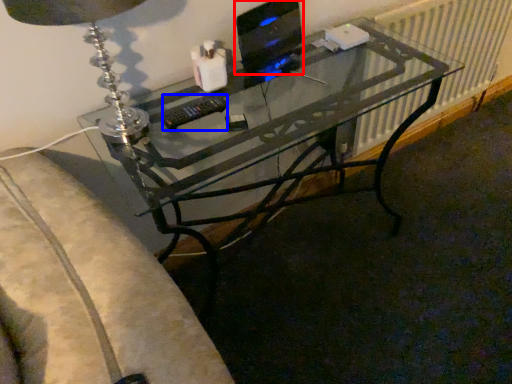
Question: Which object is further to the camera taking this photo, computer monitor (highlighted by a red box) or control (highlighted by a blue box)?

Choices:
 (A) computer monitor
 (B) control

Answer: (A)